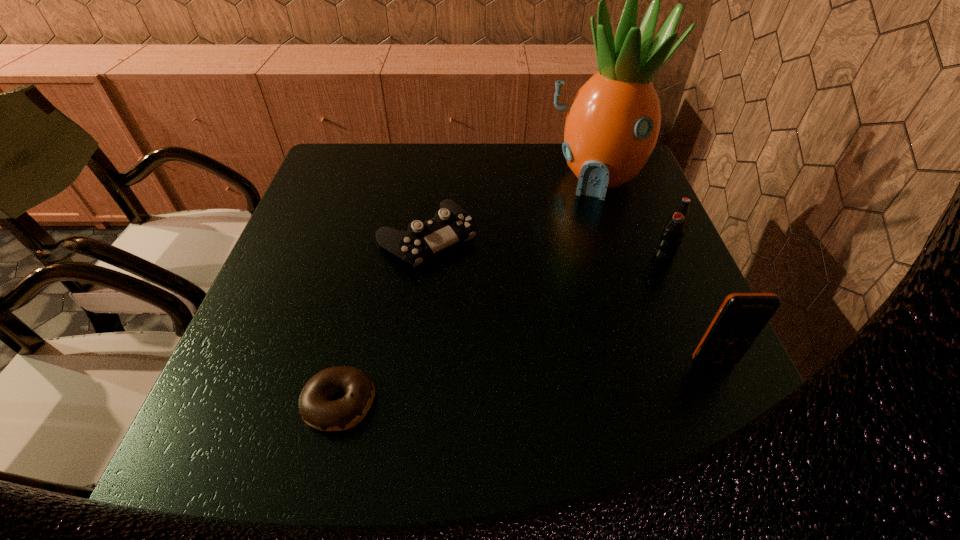
Locate an element on the screen. free space between the tallest object and the control is located at coordinates (512, 207).

This screenshot has width=960, height=540. I want to click on vacant space in between the nearest object and the pop, so click(x=502, y=329).

Image resolution: width=960 pixels, height=540 pixels. Find the location of `empty space that is in between the fourth farthest object and the third shortest object`. empty space that is in between the fourth farthest object and the third shortest object is located at coordinates click(x=688, y=309).

Locate an element on the screen. the third closest object to the pop is located at coordinates (451, 223).

Identify which object is the nearest to the shortest object. Please provide its 2D coordinates. Your answer should be formatted as a tuple, i.e. [(x, y)], where the tuple contains the x and y coordinates of a point satisfying the conditions above.

[(451, 223)]

In order to click on vacant position in the image that satisfies the following two spatial constraints: 1. on the back side of the doughnut; 2. on the left side of the tallest object in this screenshot , I will do `click(394, 176)`.

Identify the location of free spot that satisfies the following two spatial constraints: 1. on the front side of the pop; 2. on the right side of the fourth tallest object. The width and height of the screenshot is (960, 540). coord(425,256).